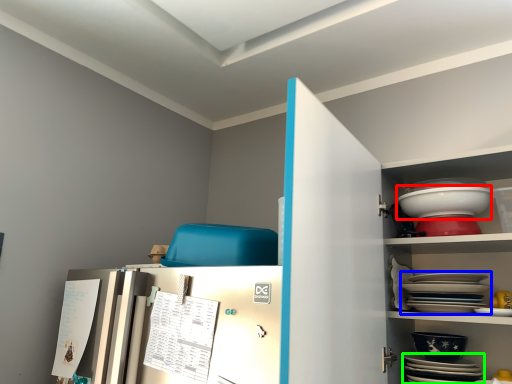
Question: Based on their relative distances, which object is farther from bowl (highlighted by a red box)? Choose from platter (highlighted by a blue box) and platter (highlighted by a green box).

Choices:
 (A) platter
 (B) platter

Answer: (B)